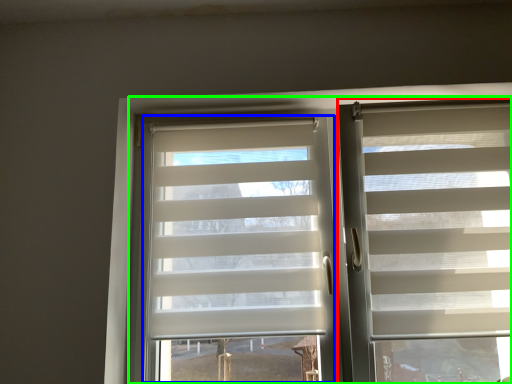
Question: Considering the real-world distances, which object is farthest from window blind (highlighted by a red box)? glass door (highlighted by a blue box) or bay window (highlighted by a green box)?

Choices:
 (A) glass door
 (B) bay window

Answer: (A)